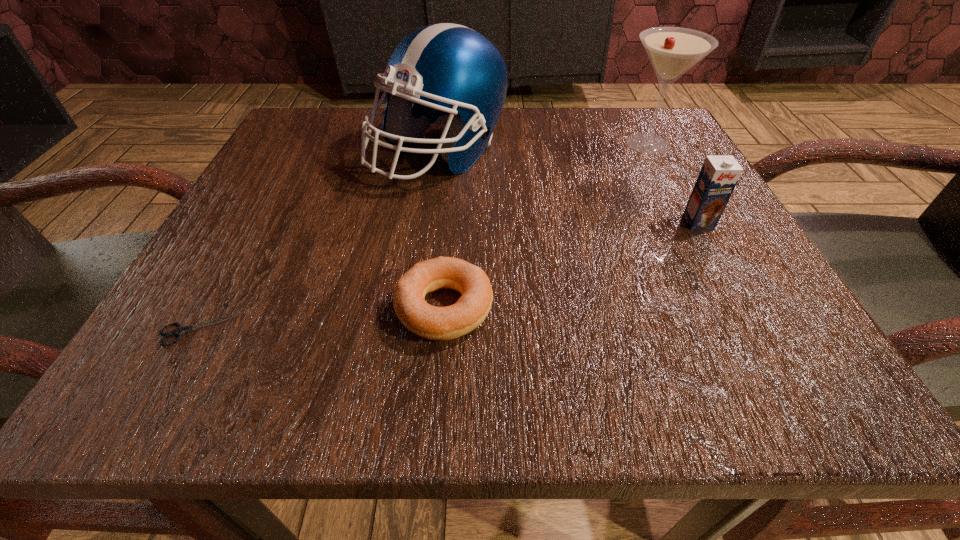
You are a GUI agent. You are given a task and a screenshot of the screen. Output one action in this format:
    pyautogui.click(x=<x>, y=<y>)
    Task: Click on the object that is positioned at the far right corner
    
    Given the screenshot: What is the action you would take?
    point(672,51)

I want to click on blank space at the far edge, so click(x=382, y=150).

This screenshot has width=960, height=540. I want to click on free location at the near edge, so click(x=379, y=335).

This screenshot has width=960, height=540. In the image, there is a desktop. In order to click on vacant space at the left edge in this screenshot , I will do `click(241, 212)`.

At what (x,y) coordinates should I click in order to perform the action: click on vacant space at the right edge of the desktop. Please return your answer as a coordinate pair (x, y). The width and height of the screenshot is (960, 540). Looking at the image, I should click on (732, 231).

The height and width of the screenshot is (540, 960). In the image, there is a desktop. Find the location of `free region at the far left corner`. free region at the far left corner is located at coordinates (300, 150).

You are a GUI agent. You are given a task and a screenshot of the screen. Output one action in this format:
    pyautogui.click(x=<x>, y=<y>)
    Task: Click on the free space at the far right corner of the desktop
    
    Given the screenshot: What is the action you would take?
    pyautogui.click(x=626, y=124)

This screenshot has width=960, height=540. Identify the location of vacant point at the near right corner. (728, 346).

Image resolution: width=960 pixels, height=540 pixels. What are the coordinates of `empty space between the football helmet and the bagel` in the screenshot? It's located at point(442,231).

Locate an element on the screen. This screenshot has width=960, height=540. free spot between the football helmet and the bagel is located at coordinates (442, 231).